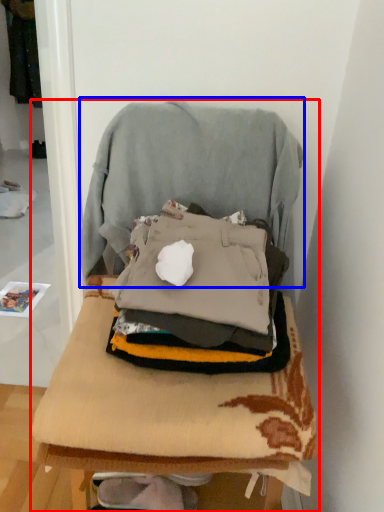
Question: Which object appears closest to the camera in this image, furniture (highlighted by a red box) or swivel chair (highlighted by a blue box)?

Choices:
 (A) furniture
 (B) swivel chair

Answer: (A)